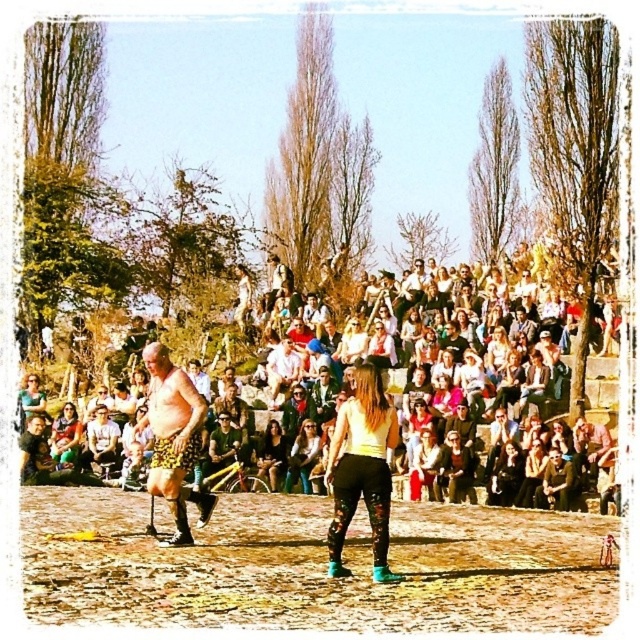
Looking at this image, does floral leggings at center come in front of matte black leggings at center?

Yes, floral leggings at center is closer to the viewer.

Describe the element at coordinates (362, 468) in the screenshot. I see `floral leggings at center` at that location.

Where is `floral leggings at center`? This screenshot has height=640, width=640. floral leggings at center is located at coordinates (362, 468).

Can you confirm if brown dirt field at center is positioned to the right of matte black leggings at center?

No, brown dirt field at center is not to the right of matte black leggings at center.

Image resolution: width=640 pixels, height=640 pixels. What do you see at coordinates (314, 566) in the screenshot?
I see `brown dirt field at center` at bounding box center [314, 566].

In order to click on brown dirt field at center in this screenshot , I will do `click(314, 566)`.

Identify the location of brown dirt field at center. The image size is (640, 640). (314, 566).

Is point (516, 412) behind point (186, 497)?

Yes, point (516, 412) is behind point (186, 497).

Can you confirm if matte black clothing at center is wider than leather shorts at left?

Correct, the width of matte black clothing at center exceeds that of leather shorts at left.

Describe the element at coordinates (465, 376) in the screenshot. I see `matte black clothing at center` at that location.

Where is `matte black clothing at center`? The image size is (640, 640). matte black clothing at center is located at coordinates (465, 376).